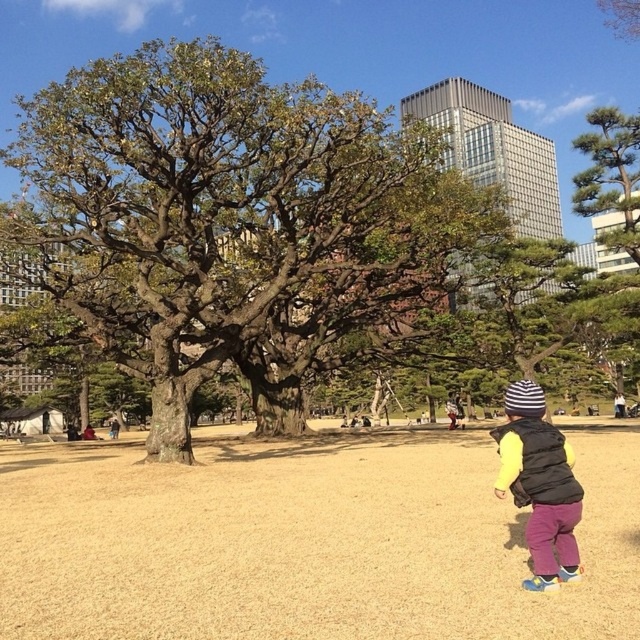
Question: Which object is farther from the camera taking this photo?

Choices:
 (A) green textured pine tree at upper right
 (B) brown textured oak tree at center
 (C) brown dry grass at center

Answer: (A)

Question: Is brown textured oak tree at center below striped knit hat at lower right?

Choices:
 (A) no
 (B) yes

Answer: (A)

Question: Which of the following is the farthest from the observer?

Choices:
 (A) striped knit hat at lower right
 (B) brown textured oak tree at center

Answer: (B)

Question: Which point is farther to the camera?

Choices:
 (A) (602, 209)
 (B) (604, 448)
 (C) (200, 323)
 (D) (552, 458)

Answer: (C)

Question: Is brown dry grass at center further to camera compared to green textured pine tree at upper right?

Choices:
 (A) no
 (B) yes

Answer: (A)

Question: Does brown textured oak tree at center have a larger size compared to brown dry grass at center?

Choices:
 (A) yes
 (B) no

Answer: (A)